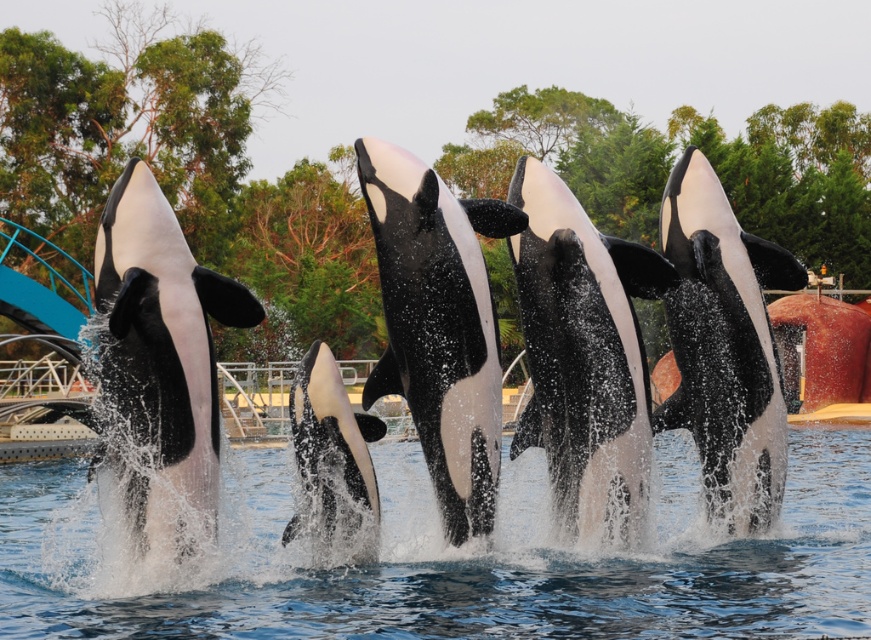
In the scene shown: Who is positioned more to the left, clear blue water at center or black smooth dolphin at center?

clear blue water at center

Which of these two, clear blue water at center or black smooth dolphin at center, stands shorter?

clear blue water at center is shorter.

What do you see at coordinates (458, 560) in the screenshot?
I see `clear blue water at center` at bounding box center [458, 560].

Identify the location of clear blue water at center. Image resolution: width=871 pixels, height=640 pixels. (458, 560).

Does black/white smooth dolphin at center lie in front of black and white dolphin at center?

Yes, black/white smooth dolphin at center is in front of black and white dolphin at center.

Find the location of a particular element. This screenshot has height=640, width=871. black/white smooth dolphin at center is located at coordinates (437, 324).

Is clear blue water at center wider than black/white smooth dolphin at center?

Correct, the width of clear blue water at center exceeds that of black/white smooth dolphin at center.

Is point (86, 630) positioned before point (454, 317)?

Yes, point (86, 630) is in front of point (454, 317).

Which is behind, point (478, 577) or point (406, 236)?

Point (478, 577)

Locate an element on the screen. The width and height of the screenshot is (871, 640). clear blue water at center is located at coordinates (458, 560).